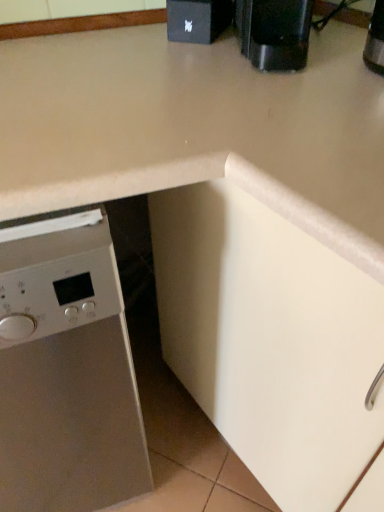
Question: From the image's perspective, is black plastic coffee machine at upper right above or below black matte speaker at upper center?

Choices:
 (A) below
 (B) above

Answer: (A)

Question: Do you think black plastic coffee machine at upper right is within black matte speaker at upper center, or outside of it?

Choices:
 (A) inside
 (B) outside

Answer: (B)

Question: Based on their relative distances, which object is nearer to the satin white dishwasher at left?

Choices:
 (A) black matte speaker at upper center
 (B) black plastic coffee machine at upper right

Answer: (B)

Question: Estimate the real-world distances between objects in this image. Which object is farther from the satin white dishwasher at left?

Choices:
 (A) black matte speaker at upper center
 (B) black plastic coffee machine at upper right

Answer: (A)